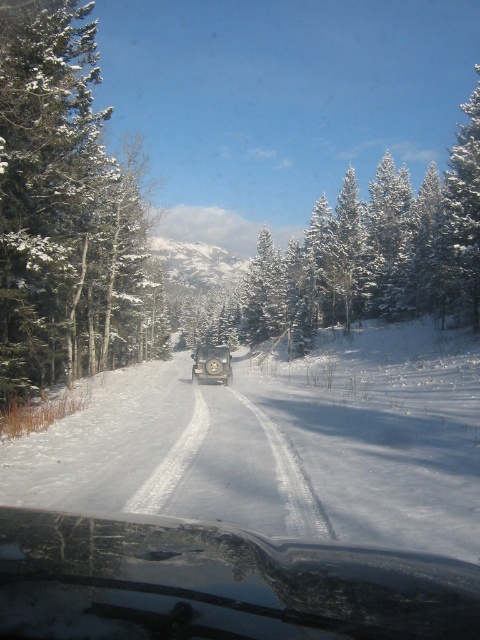
This screenshot has width=480, height=640. Find the location of `white powdery snow at center`. white powdery snow at center is located at coordinates (282, 445).

Between white powdery snow at center and snow-covered evergreen tree at left, which one has more height?

snow-covered evergreen tree at left

Does point (113, 465) come behind point (48, 372)?

No, it is in front of (48, 372).

At what (x,y) coordinates should I click in order to perform the action: click on white powdery snow at center. Please return your answer as a coordinate pair (x, y). The width and height of the screenshot is (480, 640). Looking at the image, I should click on (282, 445).

Can you confirm if white powdery snow at center is positioned to the right of satin silver car at center?

Yes, white powdery snow at center is to the right of satin silver car at center.

Does white powdery snow at center have a smaller size compared to satin silver car at center?

No, white powdery snow at center is not smaller than satin silver car at center.

Describe the element at coordinates (282, 445) in the screenshot. I see `white powdery snow at center` at that location.

Locate an element on the screen. white powdery snow at center is located at coordinates (282, 445).

Is snow-covered evergreen tree at left below satin silver car at center?

Actually, snow-covered evergreen tree at left is above satin silver car at center.

Who is shorter, snow-covered evergreen tree at left or satin silver car at center?

With less height is satin silver car at center.

Is point (24, 305) farther from viewer compared to point (230, 381)?

No, it is in front of (230, 381).

The width and height of the screenshot is (480, 640). Identify the location of snow-covered evergreen tree at left. (62, 208).